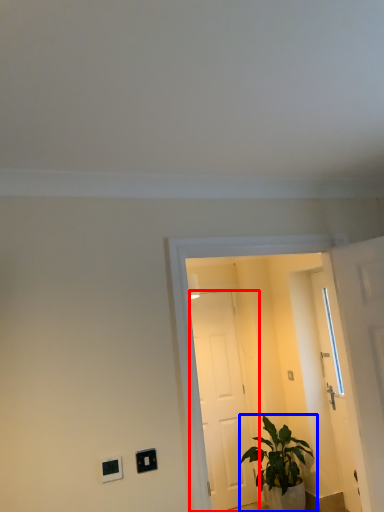
Question: Which object is further to the camera taking this photo, door (highlighted by a red box) or houseplant (highlighted by a blue box)?

Choices:
 (A) door
 (B) houseplant

Answer: (A)